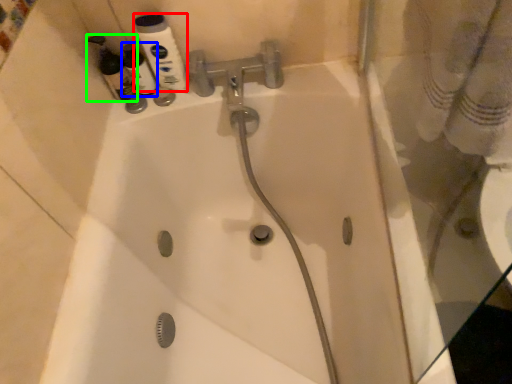
Question: Considering the real-world distances, which object is closest to mouthwash (highlighted by a red box)? cleaning product (highlighted by a blue box) or cleaning product (highlighted by a green box).

Choices:
 (A) cleaning product
 (B) cleaning product

Answer: (A)